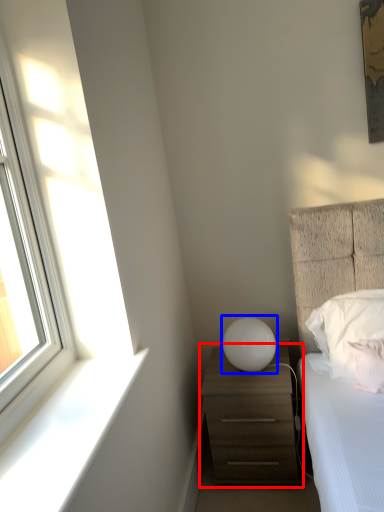
Question: Which object is closer to the camera taking this photo, chest of drawers (highlighted by a red box) or table lamp (highlighted by a blue box)?

Choices:
 (A) chest of drawers
 (B) table lamp

Answer: (A)